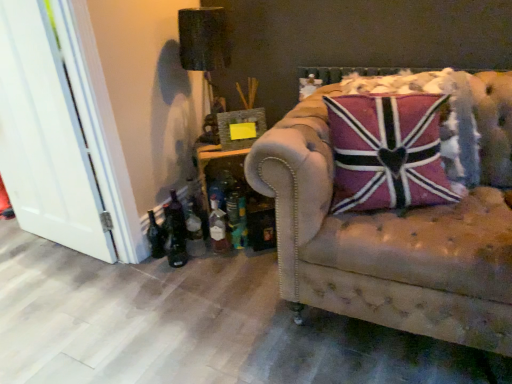
Identify the location of free point in front of white wood door at left. (49, 273).